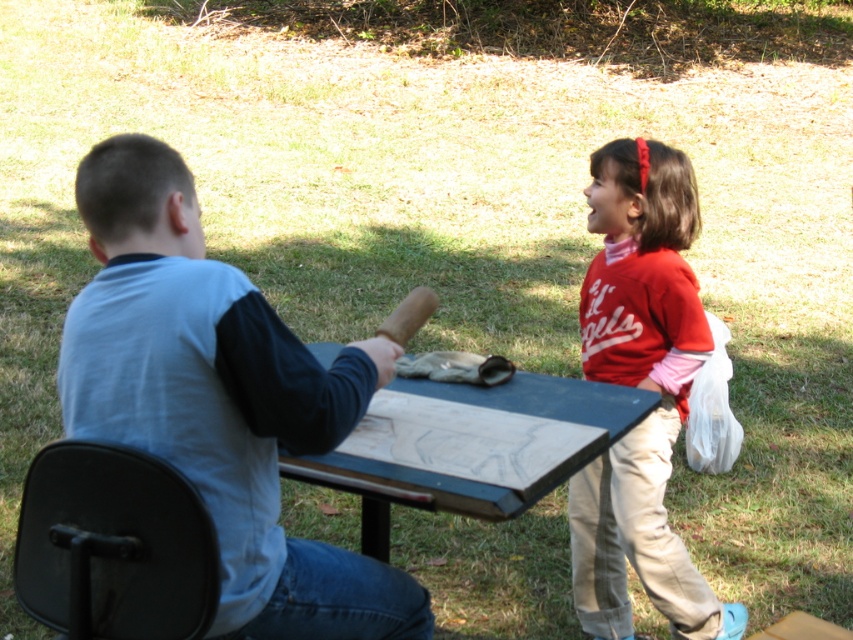
You are a photographer standing in front of the blue painted wood picnic table at center. You want to take a photo of the black plastic chair at lower left without any obstructions. Since the picnic table is between you and the chair, can you move to the side to get a clear shot?

The black plastic chair at lower left is closer to the viewer than the blue painted wood picnic table at center, so the picnic table is not blocking the view. You can take the photo without moving since the chair is already in front of the picnic table.

You are a photographer setting up for a family photo. You need to position a red prop above the blue painted wood picnic table at center. Is the current position of the matte red shirt at right suitable for this requirement?

The matte red shirt at right is already located above the blue painted wood picnic table at center, so its current position meets the requirement.